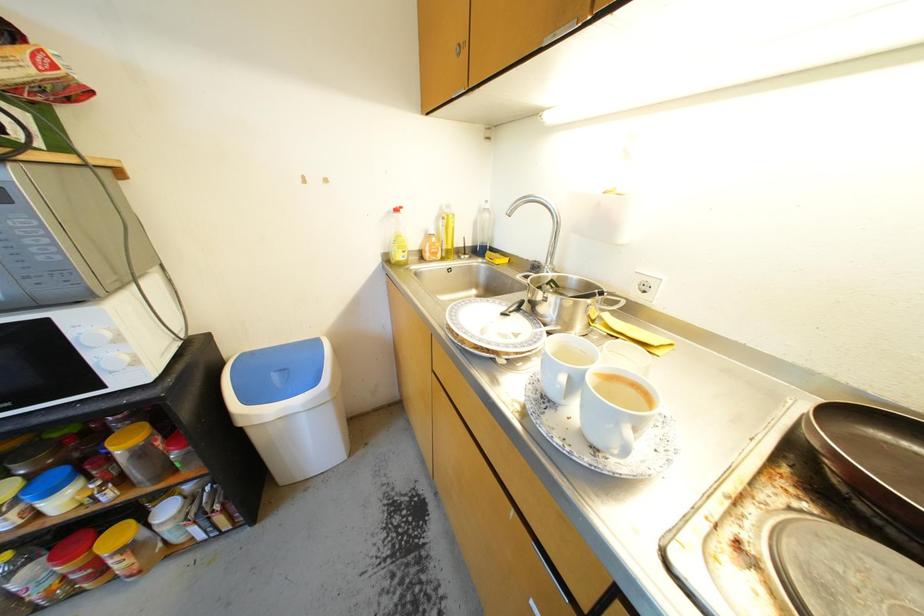
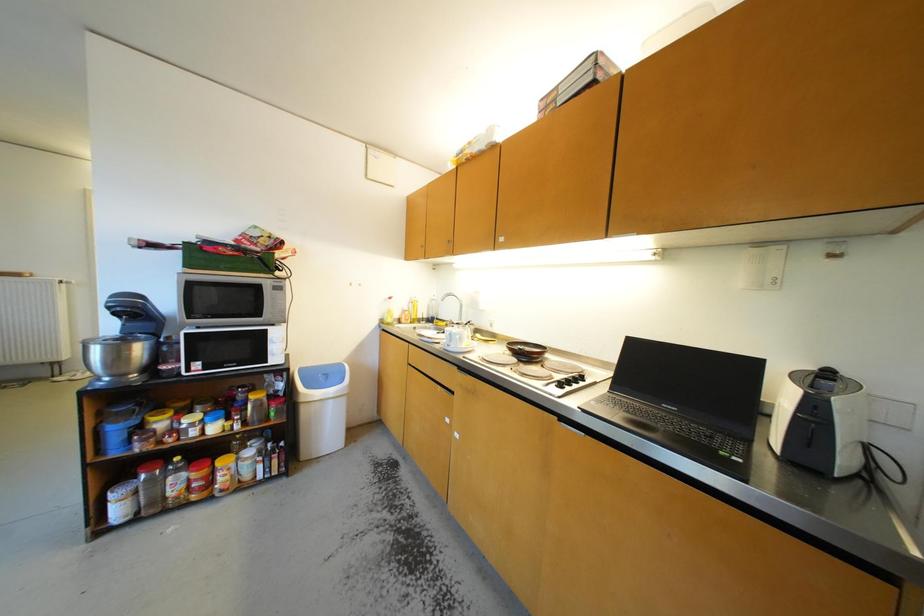
Question: In a continuous first-person perspective shot, in which direction is the camera moving?

Choices:
 (A) Left
 (B) Right
 (C) Forward
 (D) Backward

Answer: (D)